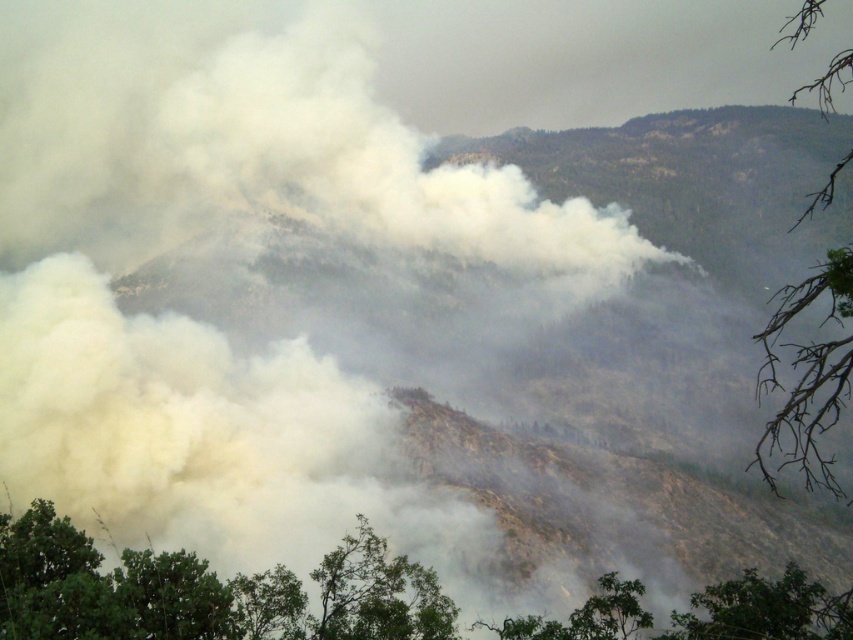
Can you confirm if brown/dry branches at right is smaller than green leafy tree at lower center?

Incorrect, brown/dry branches at right is not smaller in size than green leafy tree at lower center.

Which is behind, point (834, 362) or point (325, 625)?

The point (834, 362) is more distant.

Is point (843, 260) farther from viewer compared to point (381, 564)?

No.

Locate an element on the screen. brown/dry branches at right is located at coordinates (807, 376).

Does green leafy tree at lower center have a larger size compared to green leafy tree at lower right?

Actually, green leafy tree at lower center might be smaller than green leafy tree at lower right.

Can you confirm if green leafy tree at lower center is positioned below green leafy tree at lower right?

No.

Is point (363, 620) positioned after point (712, 584)?

No, (363, 620) is closer to viewer.

Locate an element on the screen. The height and width of the screenshot is (640, 853). green leafy tree at lower center is located at coordinates (378, 593).

Is brown/dry branches at right shorter than green leafy tree at lower right?

In fact, brown/dry branches at right may be taller than green leafy tree at lower right.

Where is `brown/dry branches at right`? brown/dry branches at right is located at coordinates (807, 376).